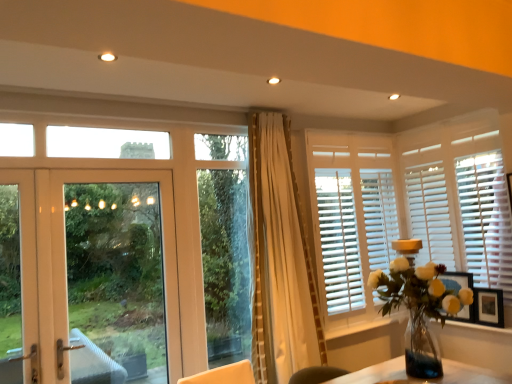
This screenshot has height=384, width=512. What do you see at coordinates (362, 332) in the screenshot?
I see `white wood window sill at lower right` at bounding box center [362, 332].

Measure the distance between point (478, 311) and camera.

They are 9.82 feet apart.

Where is `white wooden blinds at upper right`? Image resolution: width=512 pixels, height=384 pixels. white wooden blinds at upper right is located at coordinates (351, 218).

The width and height of the screenshot is (512, 384). I want to click on window blind above the white wood door at left (from a real-world perspective), so click(x=351, y=218).

Can you see white wooden blinds at upper right touching white wood door at left?

No, white wooden blinds at upper right is not in contact with white wood door at left.

Is white wooden blinds at upper right taller than white wood door at left?

Indeed, white wooden blinds at upper right has a greater height compared to white wood door at left.

Would you say white wooden blinds at upper right is to the left or to the right of white wood door at left in the picture?

Result: In the image, white wooden blinds at upper right appears on the right side of white wood door at left.

Which object is further away from the camera, white textured curtain at center or white wood door at left?

Positioned behind is white textured curtain at center.

In the image, is white textured curtain at center on the left side or the right side of white wood door at left?

white textured curtain at center is positioned on white wood door at left's right side.

Between point (258, 323) and point (51, 353), which one is positioned behind?

The point (258, 323) is more distant.

In terms of width, does white wood window sill at lower right look wider or thinner when compared to white textured curtain at center?

Considering their sizes, white wood window sill at lower right looks slimmer than white textured curtain at center.

From the image's perspective, which is below, white wood window sill at lower right or white textured curtain at center?

white wood window sill at lower right, from the image's perspective.

Is point (350, 328) closer to viewer compared to point (295, 352)?

No, it is behind (295, 352).

Can you confirm if white wood window sill at lower right is taller than white textured curtain at center?

No.

Could you tell me if white textured curtain at center is facing white wood blinds at right?

No, white textured curtain at center does not turn towards white wood blinds at right.

How many degrees apart are the facing directions of white textured curtain at center and white wood blinds at right?

91.1 degrees.

Considering the sizes of objects white textured curtain at center and white wood blinds at right in the image provided, who is bigger, white textured curtain at center or white wood blinds at right?

With larger size is white textured curtain at center.

Is white wood door at left thinner than white textured curtain at center?

Yes, white wood door at left is thinner than white textured curtain at center.

Is point (138, 349) in front of point (277, 257)?

No, it is behind (277, 257).

Could you tell me if white wood door at left is turned towards white textured curtain at center?

No, white wood door at left is not oriented towards white textured curtain at center.

Does white wood door at left contain white textured curtain at center?

No, white textured curtain at center is not surrounded by white wood door at left.

Is white wood window frame at center oriented away from white wood door at left?

No, white wood window frame at center is not facing the opposite direction of white wood door at left.

Considering the sizes of objects white wood window frame at center and white wood door at left in the image provided, who is taller, white wood window frame at center or white wood door at left?

white wood window frame at center.

Is white wood window frame at center inside the boundaries of white wood door at left, or outside?

white wood window frame at center is spatially situated outside white wood door at left.

Can you confirm if white wood window frame at center is positioned to the left of white wood door at left?

No.

How many degrees apart are the facing directions of translucent glass vase at right and white wood door at left?

They differ by 90 degrees in their facing directions.

Is the depth of translucent glass vase at right greater than that of white wood door at left?

No, translucent glass vase at right is closer to the viewer.

Find the location of a particular element. The width and height of the screenshot is (512, 384). houseplant below the white wood door at left (from a real-world perspective) is located at coordinates (419, 309).

Who is taller, translucent glass vase at right or white wood door at left?

With more height is white wood door at left.

Locate an element on the screen. The image size is (512, 384). window blind that is above the white wood door at left (from the image's perspective) is located at coordinates (351, 218).

This screenshot has width=512, height=384. What are the coordinates of `curtain above the white wood door at left (from a real-world perspective)` in the screenshot? It's located at (280, 259).

From the image, which object appears to be farther from white textured curtain at center, white wood blinds at right or translucent glass vase at right?

white wood blinds at right is further to white textured curtain at center.

From the image, which object appears to be nearer to white wood door at left, white textured curtain at center or white wood window frame at center?

white wood window frame at center is closer to white wood door at left.

Which object lies further to the anchor point white textured curtain at center, translucent glass vase at right or white wood blinds at right?

white wood blinds at right lies further to white textured curtain at center than the other object.

Which object lies nearer to the anchor point white wood window frame at center, translucent glass vase at right or white wood door at left?

white wood door at left.

From the picture: Estimate the real-world distances between objects in this image. Which object is closer to white wood blinds at right, white wood door at left or white textured curtain at center?

white textured curtain at center is positioned closer to the anchor white wood blinds at right.

Considering their positions, is white wooden blinds at upper right positioned further to white wood window sill at lower right than white wood door at left?

white wood door at left.

Considering their positions, is white wooden blinds at upper right positioned further to translucent glass vase at right than wooden picture frame at right?

wooden picture frame at right.

Which object lies nearer to the anchor point translucent glass vase at right, wooden picture frame at right or white wood door at left?

wooden picture frame at right is positioned closer to the anchor translucent glass vase at right.

Where is `window sill situated between white wood door at left and white wood blinds at right from left to right`? window sill situated between white wood door at left and white wood blinds at right from left to right is located at coordinates (362, 332).

This screenshot has height=384, width=512. Find the location of `window sill situated between white wood window frame at center and translucent glass vase at right from left to right`. window sill situated between white wood window frame at center and translucent glass vase at right from left to right is located at coordinates coord(362,332).

Find the location of a particular element. This screenshot has width=512, height=384. curtain between translucent glass vase at right and white wood window sill at lower right in the front-back direction is located at coordinates (280, 259).

At what (x,y) coordinates should I click in order to perform the action: click on window sill between white textured curtain at center and wooden picture frame at right in the horizontal direction. Please return your answer as a coordinate pair (x, y). This screenshot has height=384, width=512. Looking at the image, I should click on (362, 332).